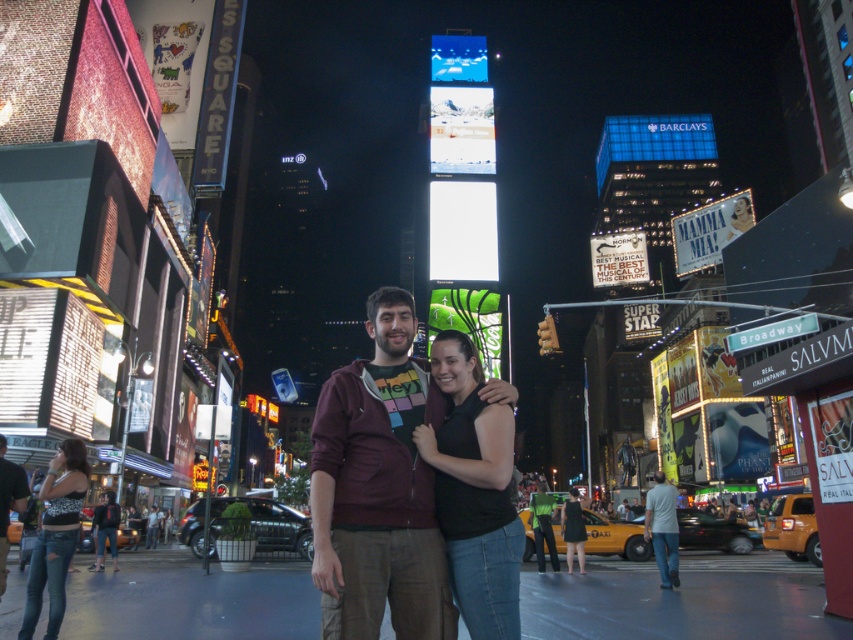
Describe the element at coordinates (378, 490) in the screenshot. I see `maroon hoodie at center` at that location.

Can you confirm if maroon hoodie at center is smaller than gray cotton shirt at lower right?

Yes.

Which is in front, point (378, 552) or point (670, 563)?

Point (378, 552)

The image size is (853, 640). In order to click on maroon hoodie at center in this screenshot , I will do `click(378, 490)`.

Is point (389, 371) closer to camera compared to point (567, 531)?

That is True.

Image resolution: width=853 pixels, height=640 pixels. What are the coordinates of `maroon hoodie at center` in the screenshot? It's located at (378, 490).

Measure the distance between point (474, 564) and camera.

The distance of point (474, 564) from camera is 96.69 feet.

In the scene shown: Is black matte tank top at center smaller than black dress at center?

Correct, black matte tank top at center occupies less space than black dress at center.

At what (x,y) coordinates should I click in order to perform the action: click on black matte tank top at center. Please return your answer as a coordinate pair (x, y). Looking at the image, I should click on tap(474, 492).

I want to click on black matte tank top at center, so click(474, 492).